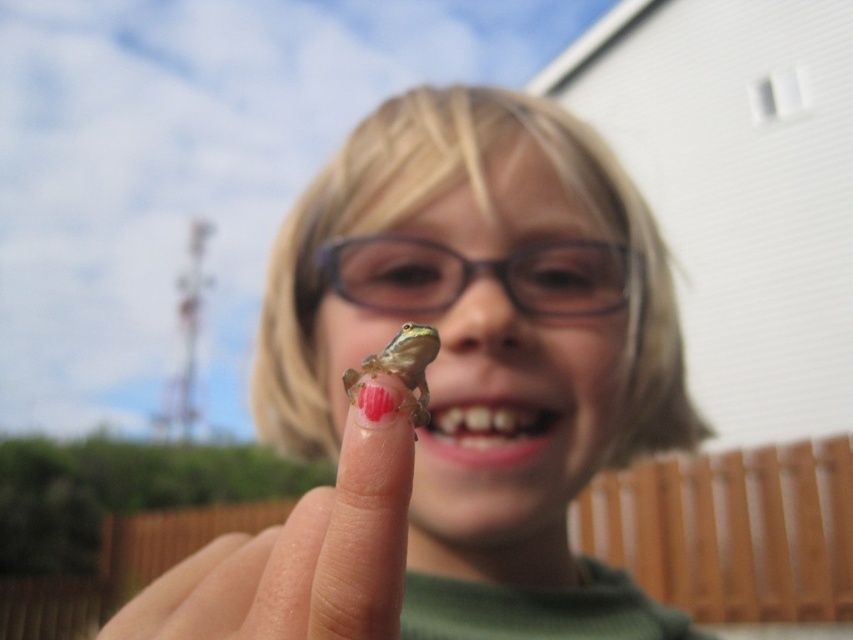
Question: Is clear plastic frog at center below green matte/frosted object at center?

Choices:
 (A) no
 (B) yes

Answer: (B)

Question: Which point is farther to the camera?

Choices:
 (A) (364, 592)
 (B) (577, 317)

Answer: (B)

Question: Can you confirm if smooth green frog at center is wider than clear plastic frog at center?

Choices:
 (A) no
 (B) yes

Answer: (B)

Question: Considering the real-world distances, which object is farthest from the smooth green frog at center?

Choices:
 (A) transparent plastic glasses at center
 (B) pink glossy teeth at lower center

Answer: (B)

Question: Based on their relative distances, which object is farther from the clear plastic frog at center?

Choices:
 (A) green matte/frosted object at center
 (B) transparent plastic glasses at center
 (C) smooth green frog at center

Answer: (C)

Question: Does smooth green frog at center have a lesser width compared to green matte/frosted object at center?

Choices:
 (A) no
 (B) yes

Answer: (A)